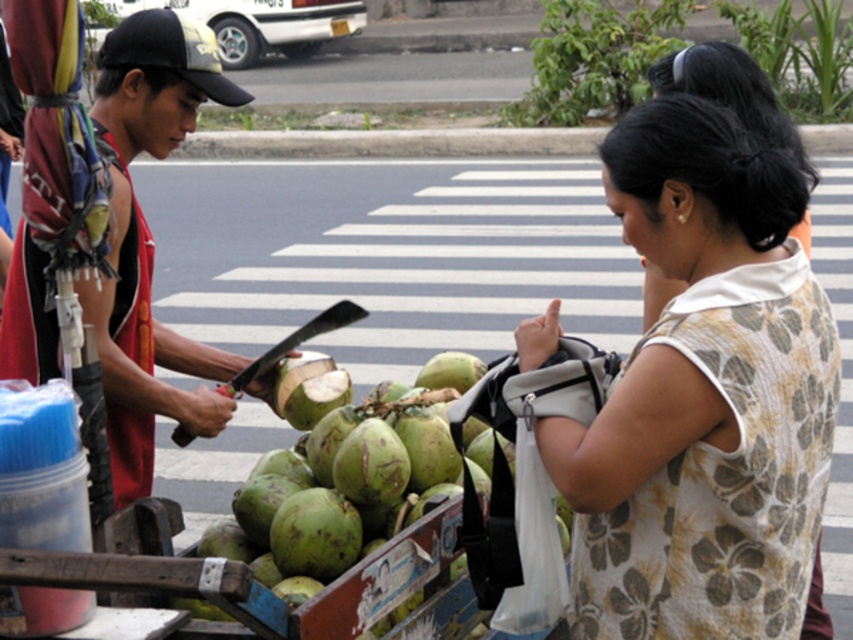
Which is behind, point (728, 369) or point (498, 476)?

Point (498, 476)

Identify the location of floral-patterned sleeveless top at upper right. The image size is (853, 640). (704, 396).

Between point (701, 390) and point (96, 129), which one is positioned in front?

Point (701, 390) is more forward.

Can you confirm if floral-patterned sleeveless top at upper right is positioned to the right of reddish-brown fabric vest at left?

Correct, you'll find floral-patterned sleeveless top at upper right to the right of reddish-brown fabric vest at left.

Locate an element on the screen. The width and height of the screenshot is (853, 640). floral-patterned sleeveless top at upper right is located at coordinates (704, 396).

This screenshot has width=853, height=640. I want to click on floral-patterned sleeveless top at upper right, so click(x=704, y=396).

Can you confirm if reddish-brown fabric vest at left is positioned to the right of green rough coconut at center?

In fact, reddish-brown fabric vest at left is to the left of green rough coconut at center.

Is reddish-brown fabric vest at left taller than green rough coconut at center?

Yes, reddish-brown fabric vest at left is taller than green rough coconut at center.

Between point (132, 449) and point (425, 488), which one is positioned in front?

Point (132, 449) is more forward.

Locate an element on the screen. This screenshot has width=853, height=640. reddish-brown fabric vest at left is located at coordinates (149, 237).